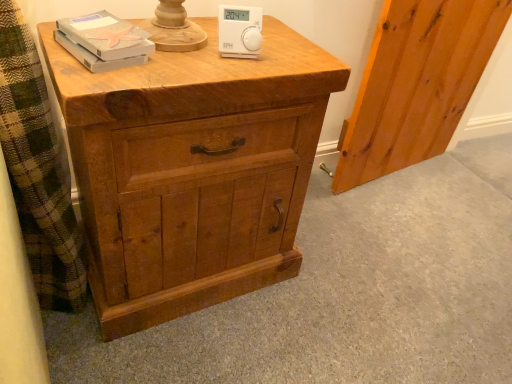
Locate an element on the screen. The width and height of the screenshot is (512, 384). blank space to the left of white plastic thermostat at upper center is located at coordinates (181, 41).